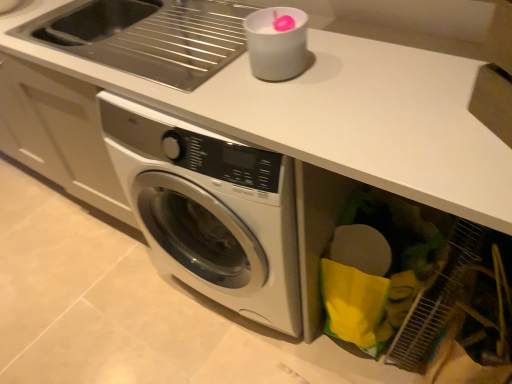
What do you see at coordinates (147, 36) in the screenshot? I see `stainless steel sink at upper left` at bounding box center [147, 36].

Where is `stainless steel sink at upper left`? The height and width of the screenshot is (384, 512). stainless steel sink at upper left is located at coordinates (147, 36).

In order to face white plastic cup at upper center, should I rotate leftwards or rightwards?

It's best to rotate right around 2.691 degrees.

You are a GUI agent. You are given a task and a screenshot of the screen. Output one action in this format:
    pyautogui.click(x=<x>, y=<y>)
    Task: Click on the white plastic cup at upper center
    The width and height of the screenshot is (512, 384).
    Given the screenshot: What is the action you would take?
    pyautogui.click(x=277, y=43)

Describe the element at coordinates (277, 43) in the screenshot. I see `white plastic cup at upper center` at that location.

The width and height of the screenshot is (512, 384). In order to click on stainless steel sink at upper left in this screenshot , I will do `click(147, 36)`.

Considering the relative positions of stainless steel sink at upper left and white plastic cup at upper center in the image provided, is stainless steel sink at upper left to the left of white plastic cup at upper center from the viewer's perspective?

Correct, you'll find stainless steel sink at upper left to the left of white plastic cup at upper center.

Looking at this image, between stainless steel sink at upper left and white plastic cup at upper center, which one is positioned behind?

stainless steel sink at upper left is further from the camera.

Which is less distant, (48, 32) or (297, 46)?

Point (48, 32).

From the image's perspective, does stainless steel sink at upper left appear higher than white plastic cup at upper center?

Yes.

From a real-world perspective, which is physically above, stainless steel sink at upper left or white plastic cup at upper center?

white plastic cup at upper center is physically above.

Is stainless steel sink at upper left thinner than white plastic cup at upper center?

No.

Who is taller, stainless steel sink at upper left or white plastic cup at upper center?

stainless steel sink at upper left.

Is stainless steel sink at upper left bigger or smaller than white plastic cup at upper center?

In the image, stainless steel sink at upper left appears to be larger than white plastic cup at upper center.

Is white plastic cup at upper center surrounded by stainless steel sink at upper left?

No, stainless steel sink at upper left does not contain white plastic cup at upper center.

Is stainless steel sink at upper left in contact with white plastic cup at upper center?

No, stainless steel sink at upper left is not with white plastic cup at upper center.

Is stainless steel sink at upper left facing away from white plastic cup at upper center?

stainless steel sink at upper left does not have its back to white plastic cup at upper center.

Identify the location of appliance on the right of stainless steel sink at upper left. (277, 43).

Is white plastic cup at upper center to the left of stainless steel sink at upper left from the viewer's perspective?

No.

Does white plastic cup at upper center lie in front of stainless steel sink at upper left?

Yes.

Which is less distant, (282, 55) or (210, 56)?

Clearly, point (282, 55) is closer to the camera than point (210, 56).

From the image's perspective, does white plastic cup at upper center appear lower than stainless steel sink at upper left?

Yes.

From a real-world perspective, is white plastic cup at upper center over stainless steel sink at upper left?

Indeed, from a real-world perspective, white plastic cup at upper center stands above stainless steel sink at upper left.

Looking at their sizes, would you say white plastic cup at upper center is wider or thinner than stainless steel sink at upper left?

Considering their sizes, white plastic cup at upper center looks slimmer than stainless steel sink at upper left.

Looking at this image, between white plastic cup at upper center and stainless steel sink at upper left, which one has more height?

stainless steel sink at upper left is taller.

Is white plastic cup at upper center smaller than stainless steel sink at upper left?

Yes.

Is white plastic cup at upper center positioned beyond the bounds of stainless steel sink at upper left?

Yes, white plastic cup at upper center is located beyond the bounds of stainless steel sink at upper left.

Is white plastic cup at upper center not close to stainless steel sink at upper left?

white plastic cup at upper center is actually quite close to stainless steel sink at upper left.

Is white plastic cup at upper center oriented towards stainless steel sink at upper left?

No, white plastic cup at upper center is not aimed at stainless steel sink at upper left.

What's the angular difference between white plastic cup at upper center and stainless steel sink at upper left's facing directions?

The angle between the facing direction of white plastic cup at upper center and the facing direction of stainless steel sink at upper left is 0.000336 degrees.

This screenshot has width=512, height=384. What are the coordinates of `sink lying behind the white plastic cup at upper center` in the screenshot? It's located at (147, 36).

Where is `appliance that is on the right side of stainless steel sink at upper left`? The image size is (512, 384). appliance that is on the right side of stainless steel sink at upper left is located at coordinates (277, 43).

Where is `sink that is under the white plastic cup at upper center (from a real-world perspective)`? Image resolution: width=512 pixels, height=384 pixels. sink that is under the white plastic cup at upper center (from a real-world perspective) is located at coordinates (147, 36).